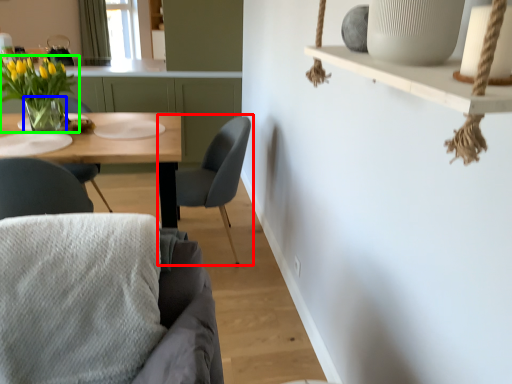
Question: Based on their relative distances, which object is nearer to chair (highlighted by a red box)? Choose from vase (highlighted by a blue box) and houseplant (highlighted by a green box).

Choices:
 (A) vase
 (B) houseplant

Answer: (A)